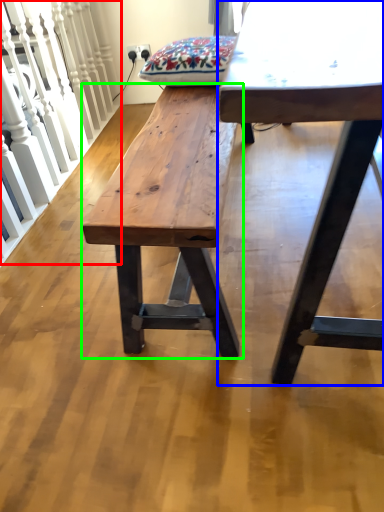
Question: Which is farther away from rail (highlighted by a red box)? table (highlighted by a blue box) or bench (highlighted by a green box)?

Choices:
 (A) table
 (B) bench

Answer: (A)